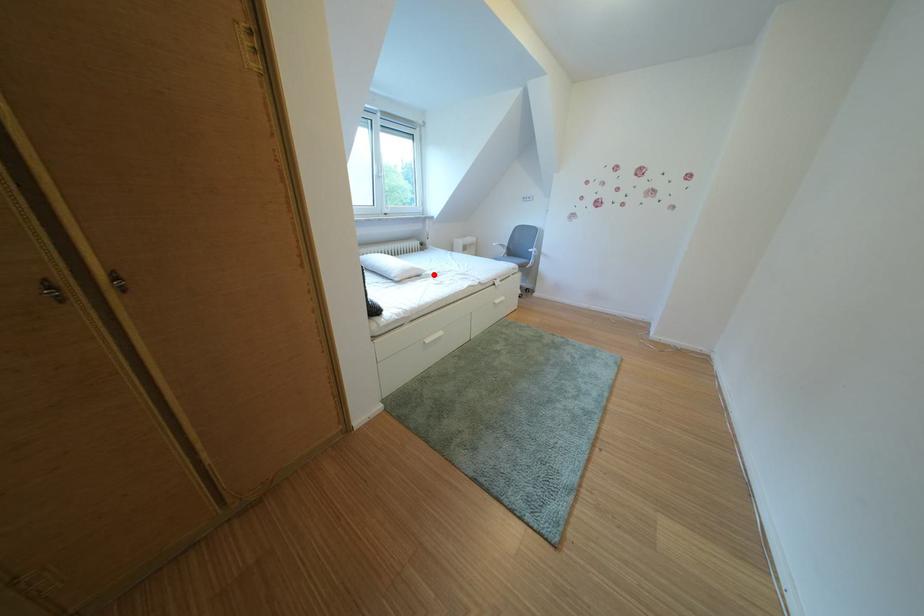
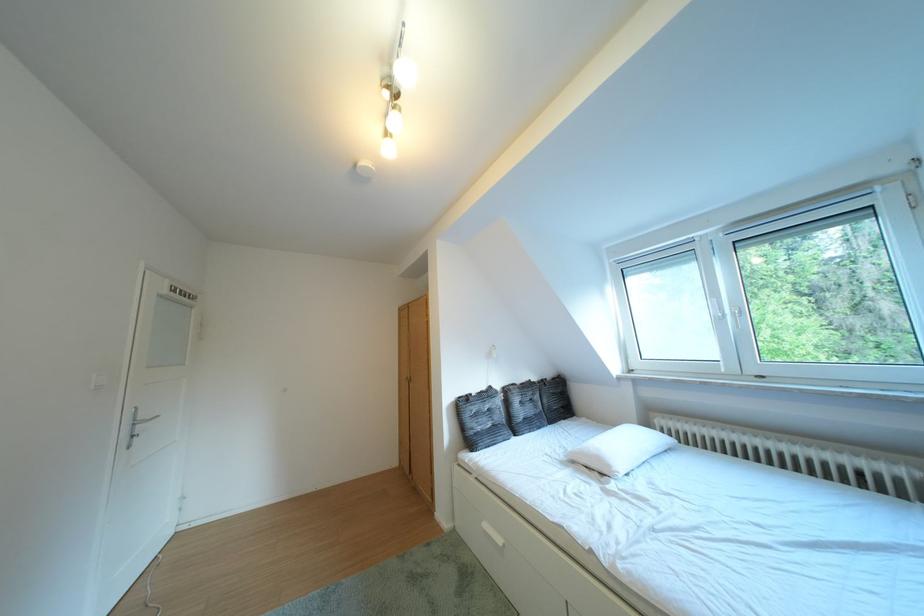
Question: I am providing you with two images of the same scene from different viewpoints. In image1, a red point is highlighted. Considering the same 3D point in image2, which of the following is correct?

Choices:
 (A) It is closer
 (B) It is farther

Answer: (B)